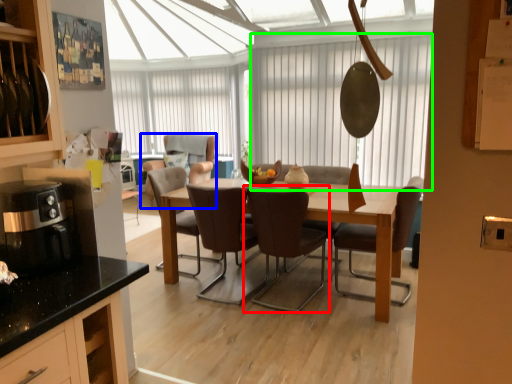
Question: Estimate the real-world distances between objects in this image. Which object is closer to chair (highlighted by a red box), chair (highlighted by a blue box) or window screen (highlighted by a green box)?

Choices:
 (A) chair
 (B) window screen

Answer: (A)